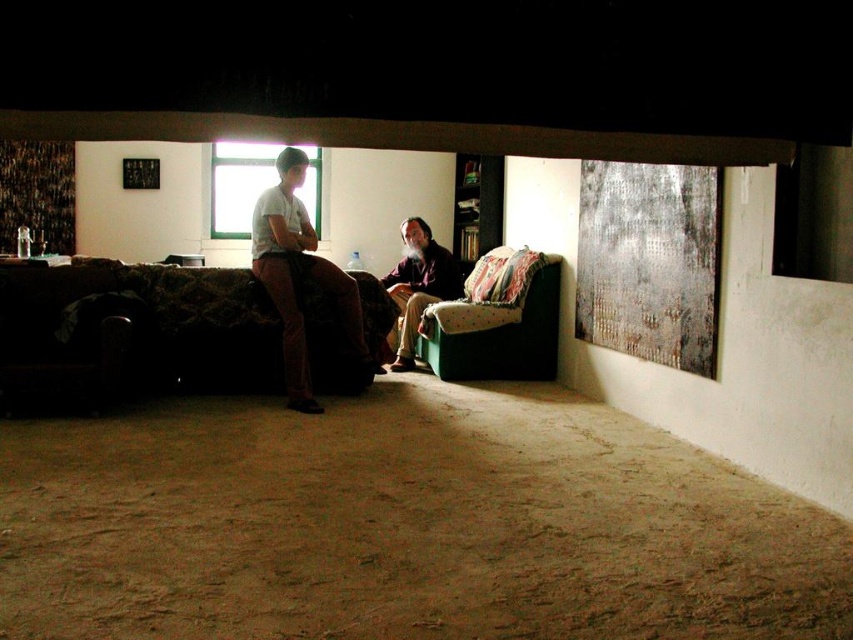
You are sitting on the beige fabric couch at center and want to reach the velvet green armchair at center. Which direction should you move to get there?

You should move to your right since the velvet green armchair at center is positioned to the right of the beige fabric couch at center.

You are standing in the room and see the matte white shirt at center and the beige fabric couch at center. Which object is nearer to you?

The matte white shirt at center is closer to the viewer than the beige fabric couch at center.

You are trying to decide whether to place a new decorative pillow on the dark fabric couch at center or the matte white shirt at center. Based on their sizes, which object would be more suitable for placing the pillow?

The dark fabric couch at center is bigger than the matte white shirt at center, so the dark fabric couch at center would be more suitable for placing the decorative pillow.